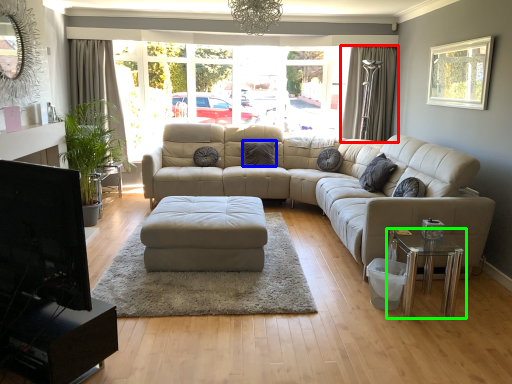
Question: Based on their relative distances, which object is farther from curtain (highlighted by a red box)? Choose from pillow (highlighted by a blue box) and table (highlighted by a green box).

Choices:
 (A) pillow
 (B) table

Answer: (B)